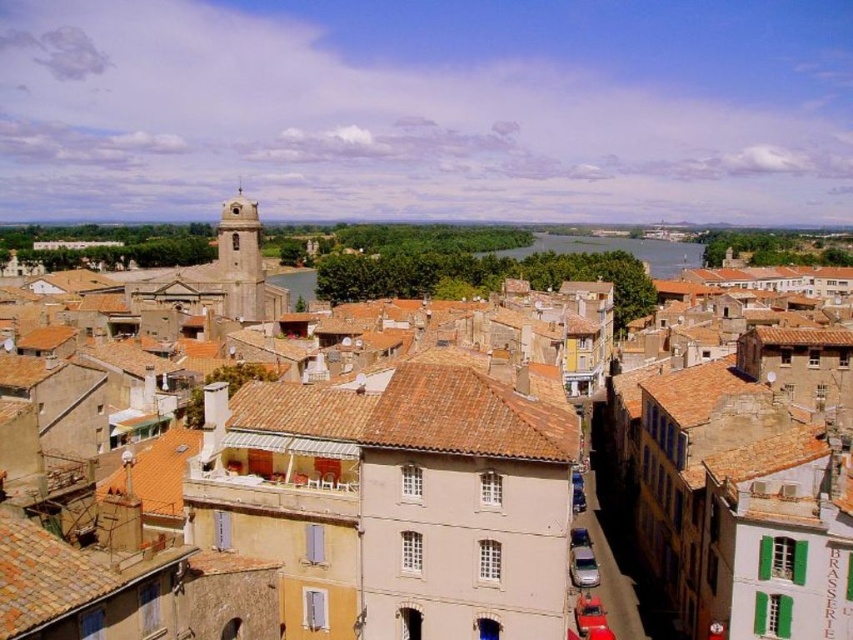
Can you confirm if brown clay roof tiles at center is taller than metallic silver car at center?

Yes.

Between brown clay roof tiles at center and metallic silver car at center, which one is positioned higher?

brown clay roof tiles at center

Which is in front, point (215, 448) or point (587, 531)?

Positioned in front is point (215, 448).

This screenshot has height=640, width=853. Identify the location of brown clay roof tiles at center. (413, 502).

Is brown clay roof tiles at center thinner than smooth stone tower at upper left?

No, brown clay roof tiles at center is not thinner than smooth stone tower at upper left.

Which of these two, brown clay roof tiles at center or smooth stone tower at upper left, stands taller?

smooth stone tower at upper left is taller.

Does point (206, 512) come closer to viewer compared to point (241, 291)?

Yes, point (206, 512) is in front of point (241, 291).

At what (x,y) coordinates should I click in order to perform the action: click on brown clay roof tiles at center. Please return your answer as a coordinate pair (x, y). The width and height of the screenshot is (853, 640). Looking at the image, I should click on (413, 502).

Is point (247, 253) behind point (578, 545)?

Yes, it is.

Which of these two, smooth stone tower at upper left or metallic silver car at center, stands shorter?

metallic silver car at center

Locate an element on the screen. smooth stone tower at upper left is located at coordinates (241, 259).

You are a GUI agent. You are given a task and a screenshot of the screen. Output one action in this format:
    pyautogui.click(x=<x>, y=<y>)
    Task: Click on the smooth stone tower at upper left
    Image resolution: width=853 pixels, height=640 pixels.
    Given the screenshot: What is the action you would take?
    pyautogui.click(x=241, y=259)